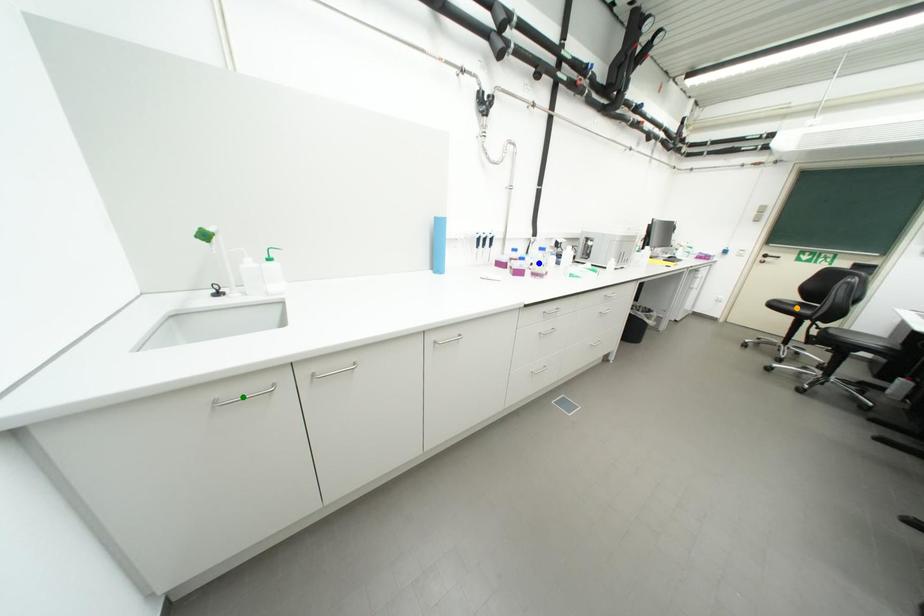
Order these from nearest to farthest:
green point | orange point | blue point

orange point < blue point < green point